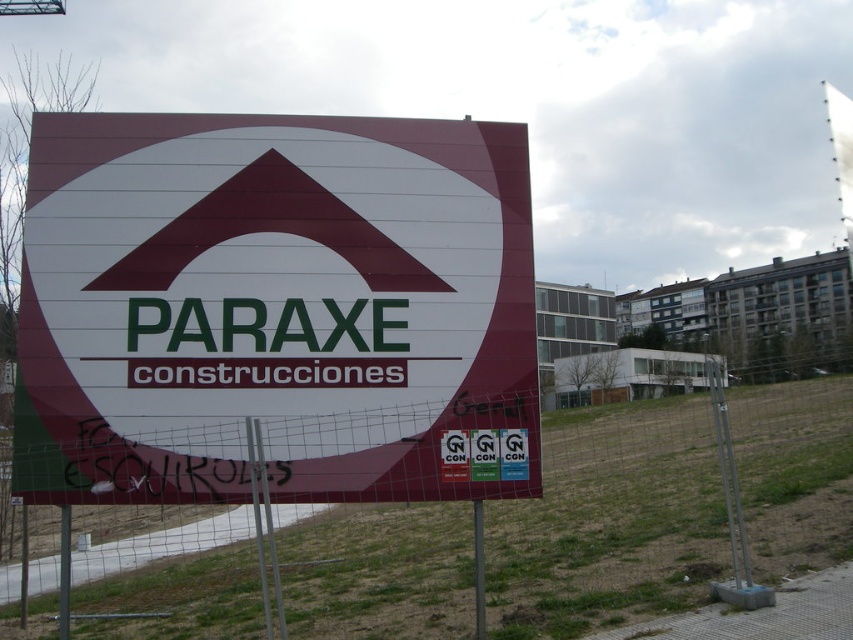
You are a delivery driver approaching the construction site. You see the maroon plastic sign at center and the metal mesh fence at center. Which object is closer to you as you approach?

The maroon plastic sign at center is closer to the viewer than the metal mesh fence at center, so the maroon plastic sign at center is closer to you as you approach.

You are standing in front of the construction site and see the maroon plastic sign at center. If you want to locate it precisely on a coordinate system where the bottom left corner is the origin, what are its coordinates?

The maroon plastic sign at center is located at coordinates point [273,305].

Based on the photo, you are a delivery driver approaching the construction site and see the maroon plastic sign at center and the metal mesh fence at center. Which object is shorter in height?

The maroon plastic sign at center is not as tall as the metal mesh fence at center, so the maroon plastic sign at center is shorter in height.